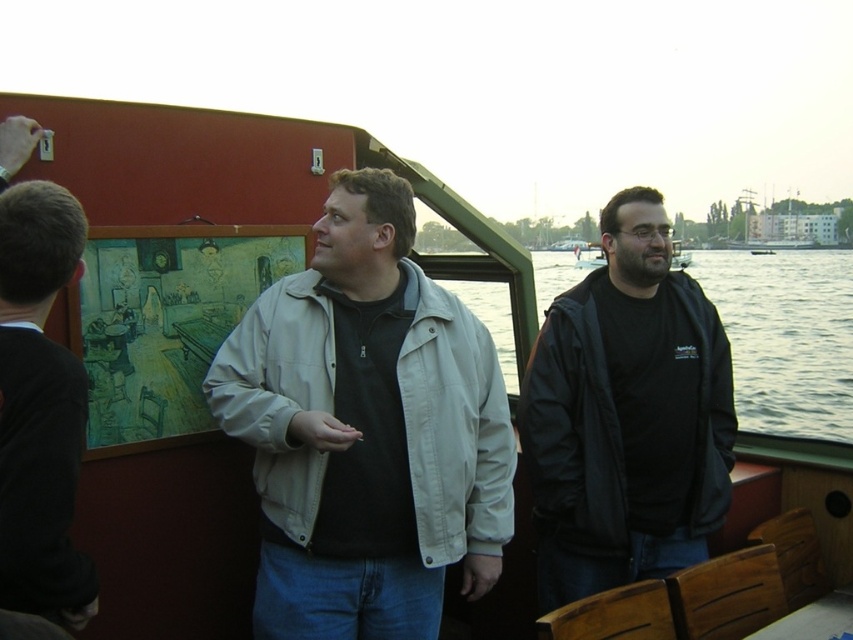
Based on the photo, who is lower down, light beige jacket at center or clear water at right?

Positioned lower is light beige jacket at center.

Is light beige jacket at center thinner than clear water at right?

Correct, light beige jacket at center's width is less than clear water at right's.

The width and height of the screenshot is (853, 640). Describe the element at coordinates (366, 429) in the screenshot. I see `light beige jacket at center` at that location.

Find the location of `light beige jacket at center`. light beige jacket at center is located at coordinates (366, 429).

Is point (74, 266) in front of point (849, 369)?

Yes, point (74, 266) is in front of point (849, 369).

Can you confirm if dark gray sweater at left is smaller than clear water at right?

Indeed, dark gray sweater at left has a smaller size compared to clear water at right.

Between point (33, 323) and point (421, 257), which one is positioned in front?

Positioned in front is point (33, 323).

At what (x,y) coordinates should I click in order to perform the action: click on dark gray sweater at left. Please return your answer as a coordinate pair (x, y). Looking at the image, I should click on (39, 406).

Is light beige jacket at center below dark gray sweater at left?

Yes.

Which is below, light beige jacket at center or dark gray sweater at left?

light beige jacket at center

Where is `light beige jacket at center`? light beige jacket at center is located at coordinates (366, 429).

Locate an element on the screen. light beige jacket at center is located at coordinates (366, 429).